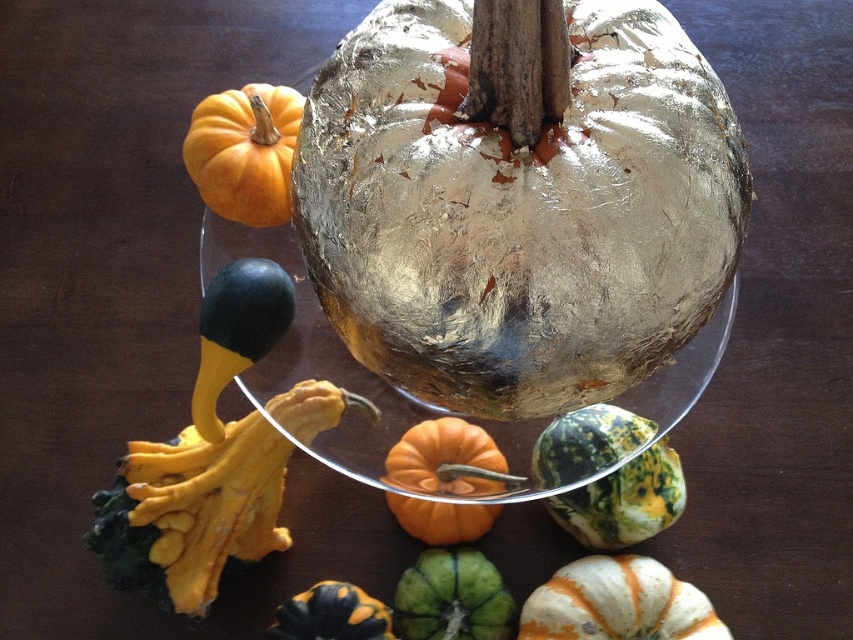
Question: Can you confirm if orange matte pumpkin at upper left is positioned to the right of orange matte pumpkin at center?

Choices:
 (A) no
 (B) yes

Answer: (A)

Question: Which point appears closest to the camera in this image?

Choices:
 (A) (694, 180)
 (B) (396, 604)
 (C) (204, 179)

Answer: (A)

Question: Is green speckled gourd at center bigger than orange and black striped gourd at lower center?

Choices:
 (A) no
 (B) yes

Answer: (B)

Question: Estimate the real-world distances between objects in this image. Which object is closer to the metallic silver pumpkin at center?

Choices:
 (A) orange matte pumpkin at center
 (B) orange and black striped gourd at lower center

Answer: (A)

Question: Can you confirm if orange matte pumpkin at upper left is bigger than orange matte pumpkin at center?

Choices:
 (A) yes
 (B) no

Answer: (A)

Question: Which point appears closest to the camera in this image?

Choices:
 (A) (267, 208)
 (B) (636, 577)

Answer: (A)